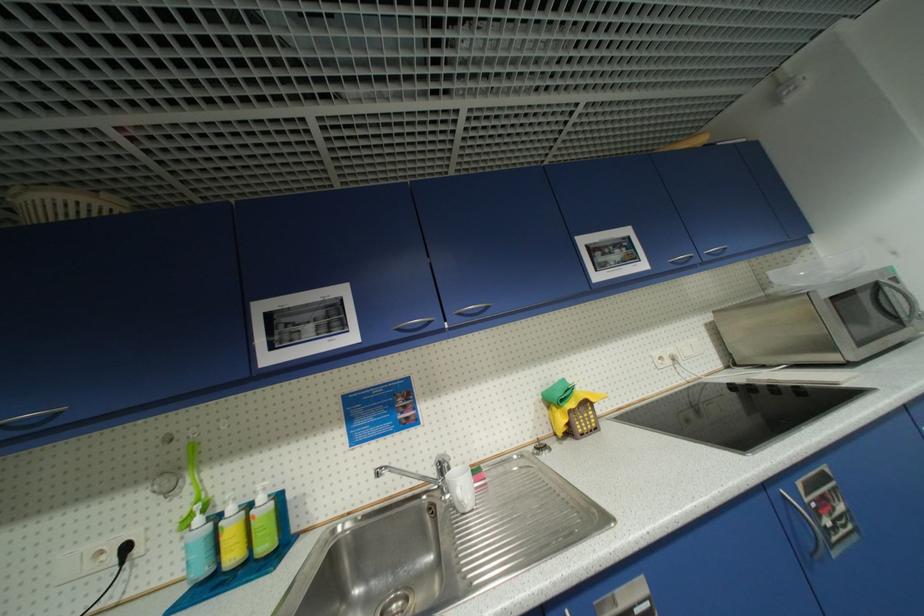
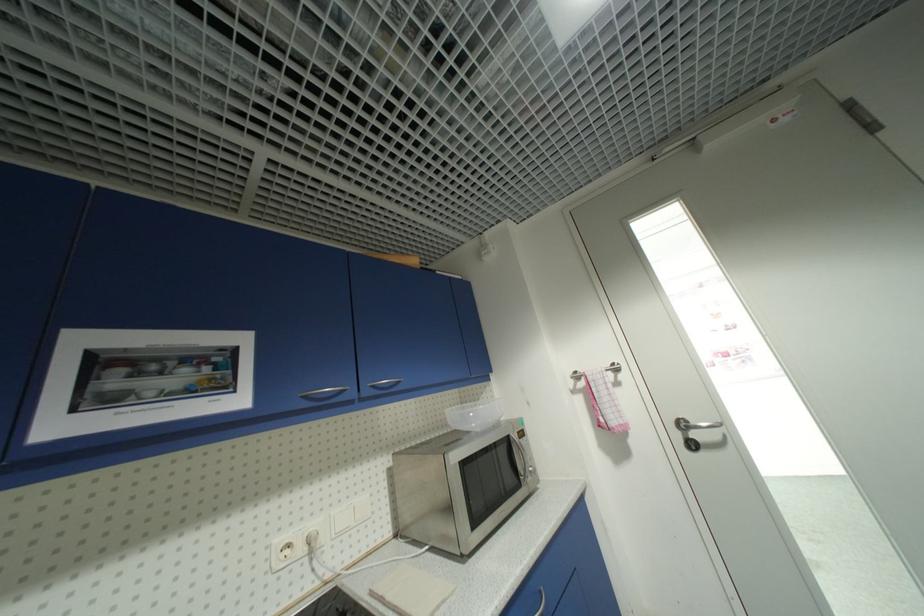
From the picture: How did the camera likely rotate?

The rotation direction of the camera is right-up.